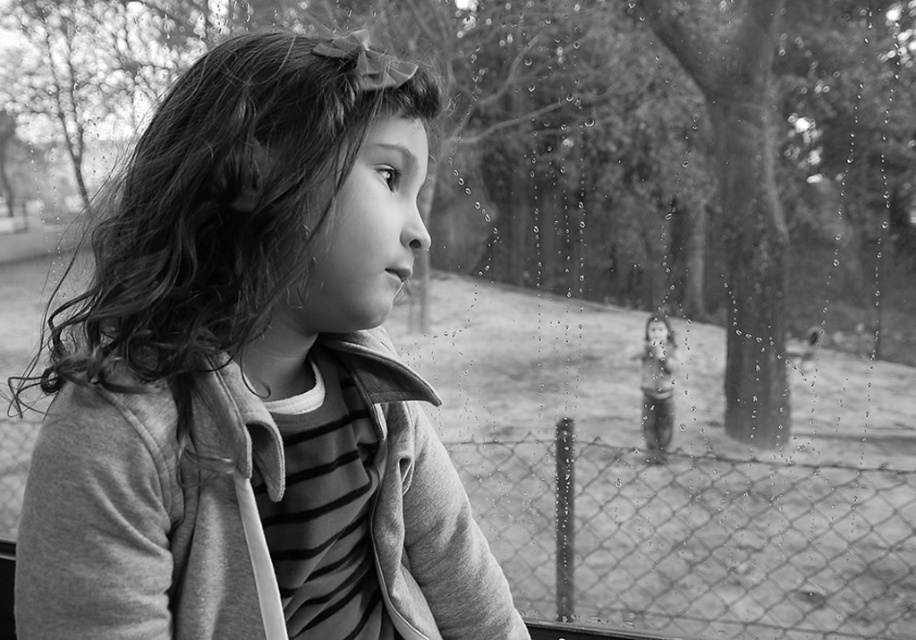
Question: Can you confirm if soft fabric girl at left is wider than wire mesh fence at lower center?

Choices:
 (A) no
 (B) yes

Answer: (A)

Question: From the image, what is the correct spatial relationship of soft fabric girl at left in relation to wire mesh fence at lower center?

Choices:
 (A) right
 (B) left

Answer: (B)

Question: Which of the following is the closest to the observer?

Choices:
 (A) soft fabric girl at left
 (B) wire mesh fence at lower center

Answer: (A)

Question: Is soft fabric girl at left thinner than wire mesh fence at lower center?

Choices:
 (A) no
 (B) yes

Answer: (B)

Question: Which object appears closest to the camera in this image?

Choices:
 (A) soft fabric girl at left
 (B) wire mesh fence at lower center

Answer: (A)